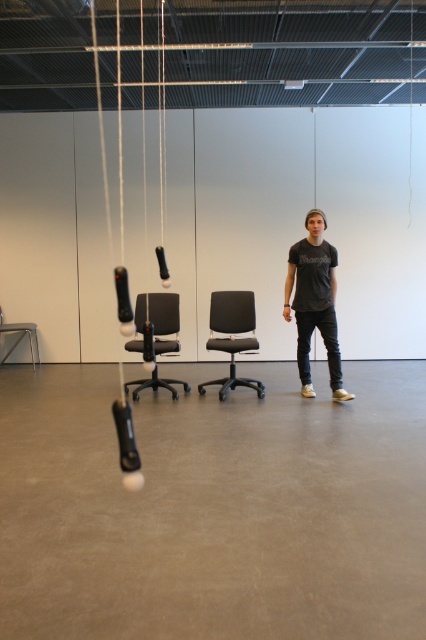
You are moving a large delivery box into the room and need to navigate around the two chairs. Since the matte black office chair at center and the metallic gray chair at lower left are positioned in the room, which direction should you approach from to avoid bumping into either?

The matte black office chair at center is to the right of the metallic gray chair at lower left, so approaching from the left side of the metallic gray chair at lower left would allow you to bypass both chairs without collision.

You are a delivery person entering the room and need to place a large package between the matte black office chair at center and the metallic gray chair at lower left. Can you fit the package between them if it requires 1 meter of space?

The matte black office chair at center is in front of the metallic gray chair at lower left, but the exact distance between them is not provided. Without knowing the distance, it is impossible to determine if the package will fit.